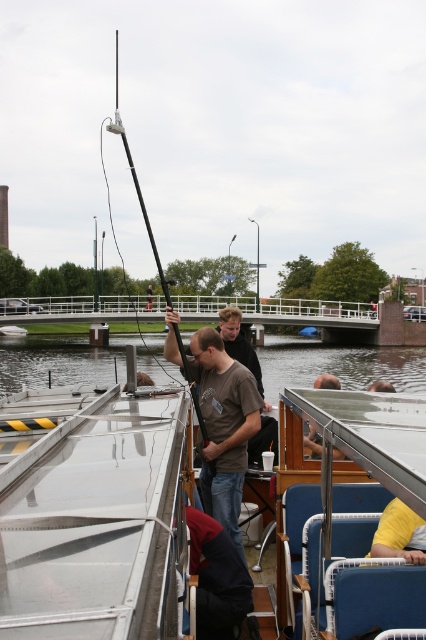
Question: Which point is farther to the camera?

Choices:
 (A) (244, 584)
 (B) (316, 456)
 (C) (402, 536)
 (D) (149, 296)

Answer: (D)

Question: Which of the following is the farthest from the observer?

Choices:
 (A) (149, 301)
 (B) (230, 616)
 (C) (227, 424)
 (D) (331, 381)

Answer: (A)

Question: Can you confirm if white glossy boat at lower left is positioned to the left of brown cotton shirt at center?

Choices:
 (A) yes
 (B) no

Answer: (B)

Question: Which point is farther to the camera?

Choices:
 (A) (408, 529)
 (B) (317, 442)

Answer: (B)

Question: Is yellow fabric at lower right to the left of brown cotton shirt at center from the viewer's perspective?

Choices:
 (A) yes
 (B) no

Answer: (B)

Question: Where is white glossy boat at lower left located in relation to dark blue fabric jacket at lower center in the image?

Choices:
 (A) right
 (B) left

Answer: (B)